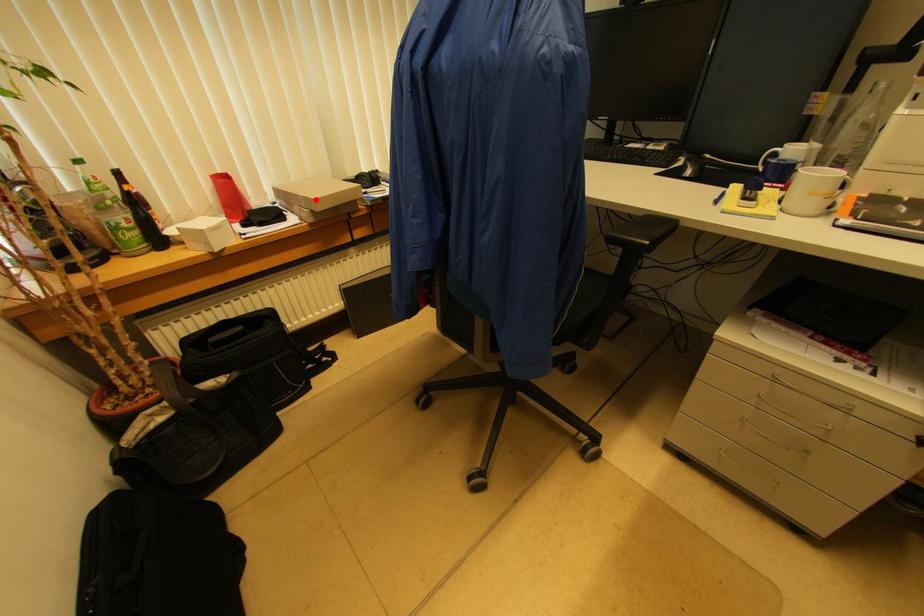
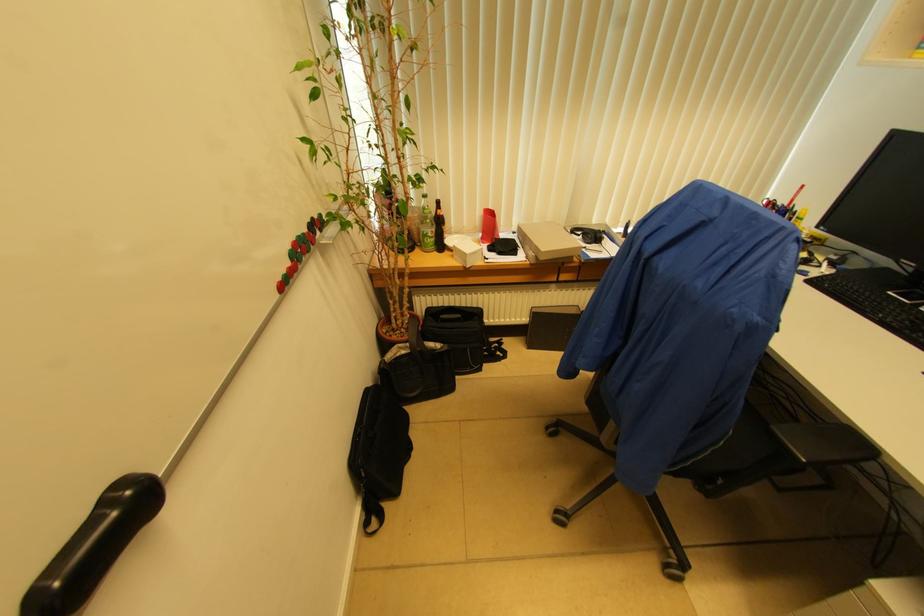
The point at the highlighted location is marked in the first image. Where is the corresponding point in the second image?

(543, 252)